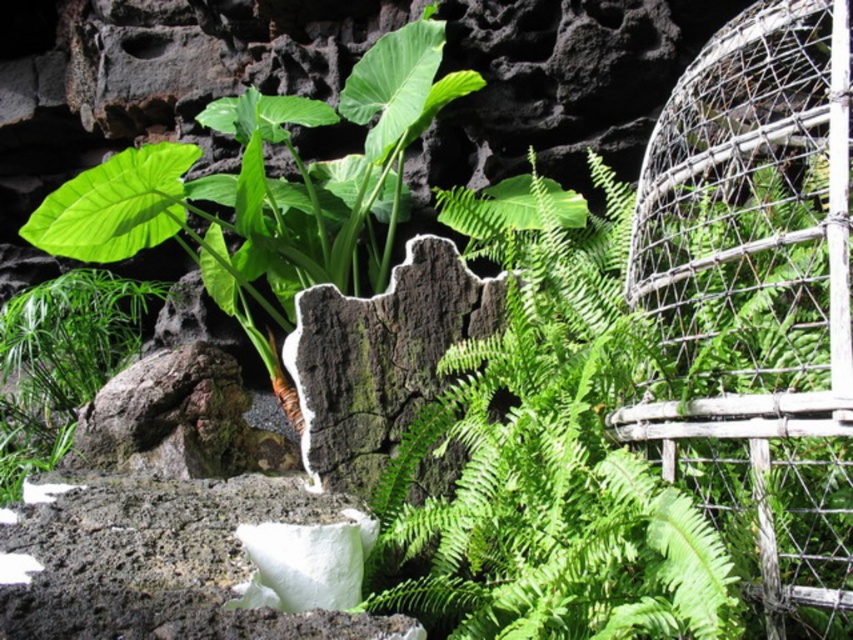
Who is positioned more to the left, rustic wire birdcage at right or green leafy plant at lower left?

green leafy plant at lower left

Is rustic wire birdcage at right in front of green leafy plant at lower left?

Yes, it is in front of green leafy plant at lower left.

Does point (711, 465) lie in front of point (0, 451)?

Yes, it is.

Locate an element on the screen. rustic wire birdcage at right is located at coordinates (757, 304).

Between green leafy plant at center and dark brown rough stone at center, which one has more height?

green leafy plant at center

Where is `green leafy plant at center`? This screenshot has width=853, height=640. green leafy plant at center is located at coordinates (548, 461).

Which is in front, point (605, 387) or point (299, 294)?

Point (605, 387) is in front.

This screenshot has height=640, width=853. In order to click on green leafy plant at center in this screenshot , I will do `click(548, 461)`.

In the scene shown: Measure the distance from rustic wire birdcage at right to dark brown rough stone at center.

rustic wire birdcage at right is 89.50 centimeters away from dark brown rough stone at center.

This screenshot has width=853, height=640. Describe the element at coordinates (757, 304) in the screenshot. I see `rustic wire birdcage at right` at that location.

Does point (692, 93) come closer to viewer compared to point (428, 257)?

Yes, it is in front of point (428, 257).

At what (x,y) coordinates should I click in order to perform the action: click on rustic wire birdcage at right. Please return your answer as a coordinate pair (x, y). The height and width of the screenshot is (640, 853). Looking at the image, I should click on (757, 304).